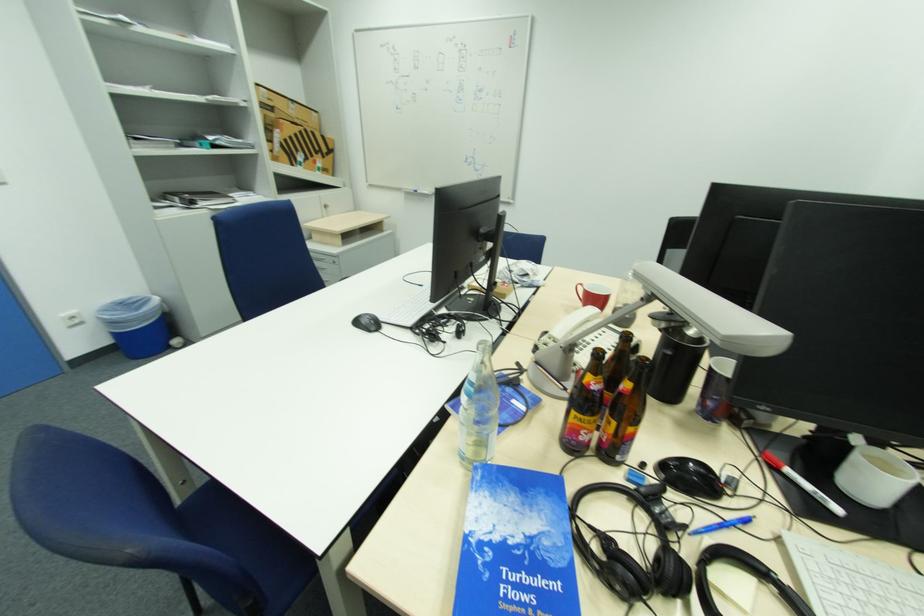
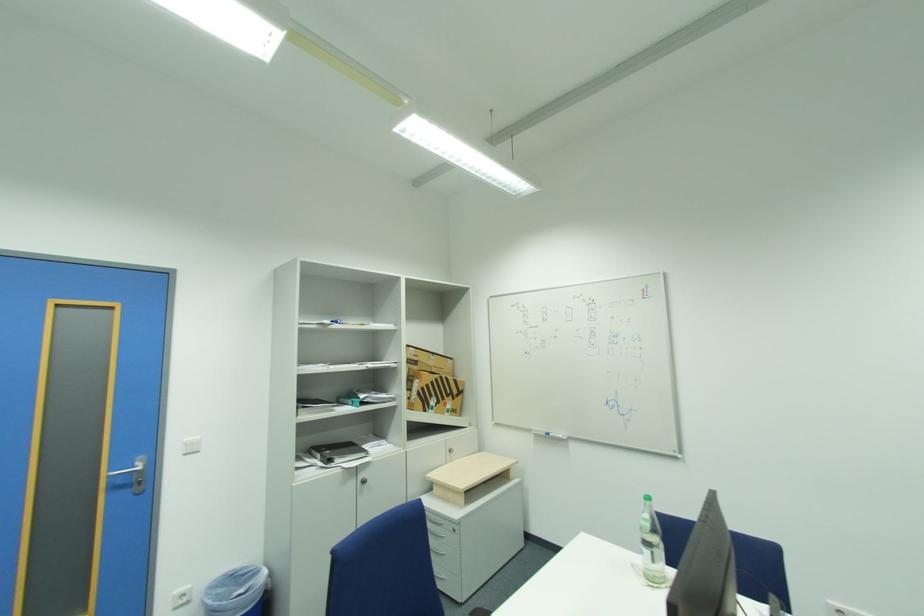
How did the camera likely rotate?

The camera rotated toward left-up.